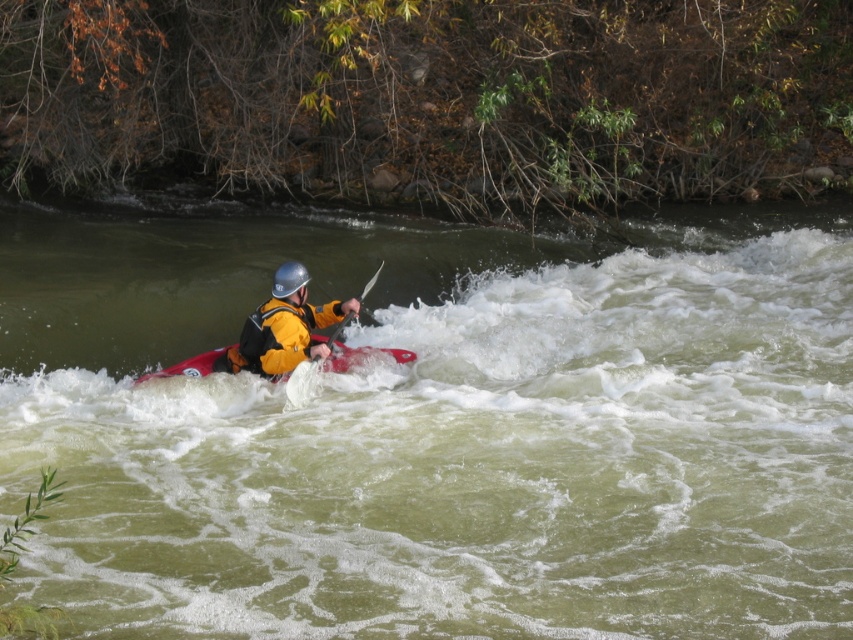
Question: Considering the relative positions of red matte kayak at center and matte black paddle at center in the image provided, where is red matte kayak at center located with respect to matte black paddle at center?

Choices:
 (A) right
 (B) left

Answer: (A)

Question: Which of these objects is positioned closest to the red matte kayak at center?

Choices:
 (A) yellow matte life jacket at center
 (B) yellow matte jacket at center
 (C) silver metallic helmet at center

Answer: (B)

Question: Which is farther from the yellow matte jacket at center?

Choices:
 (A) yellow matte life jacket at center
 (B) green rubber kayak at center
 (C) silver metallic helmet at center
 (D) red matte kayak at center

Answer: (B)

Question: Can you confirm if matte black paddle at center is wider than silver metallic helmet at center?

Choices:
 (A) yes
 (B) no

Answer: (A)

Question: Is yellow matte jacket at center to the right of yellow matte life jacket at center from the viewer's perspective?

Choices:
 (A) no
 (B) yes

Answer: (B)

Question: Based on their relative distances, which object is farther from the red matte kayak at center?

Choices:
 (A) green rubber kayak at center
 (B) yellow matte jacket at center

Answer: (A)